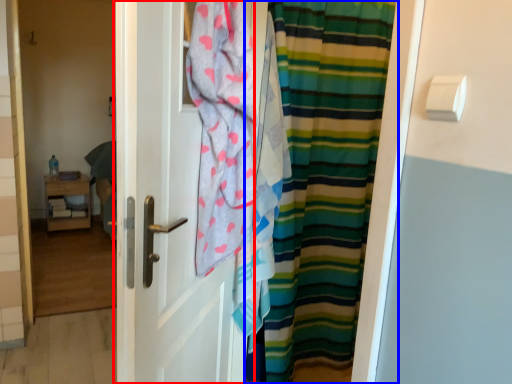
Question: Among these objects, which one is farthest to the camera, door (highlighted by a red box) or curtain (highlighted by a blue box)?

Choices:
 (A) door
 (B) curtain

Answer: (B)